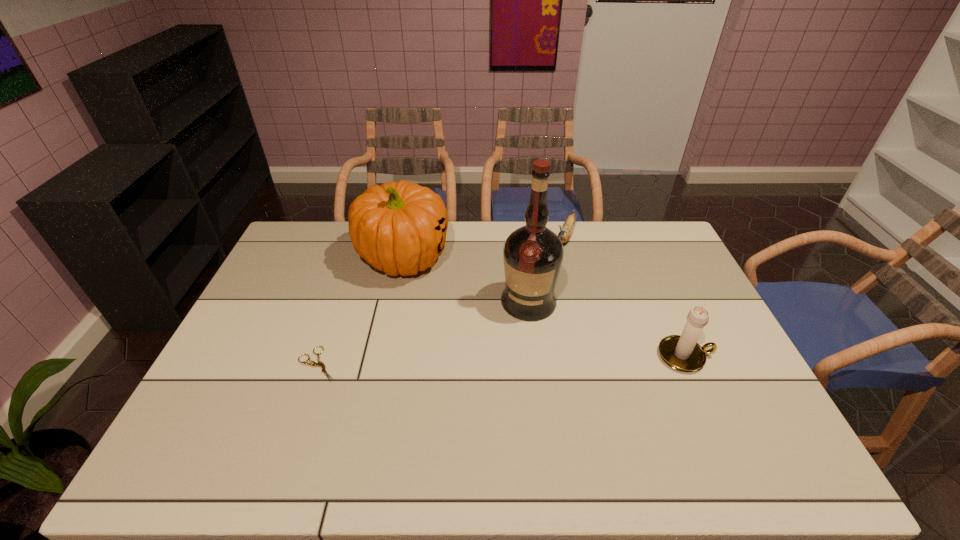
You are a GUI agent. You are given a task and a screenshot of the screen. Output one action in this format:
    pyautogui.click(x=<x>, y=<y>)
    Task: Click on the vacant region that satisfies the following two spatial constraints: 1. on the back side of the liquor; 2. on the left side of the second object from right to left
    Image resolution: width=960 pixels, height=540 pixels.
    Given the screenshot: What is the action you would take?
    pyautogui.click(x=520, y=236)

Identify the location of vacant area in the image that satisfies the following two spatial constraints: 1. on the front side of the candle holder; 2. on the handle side of the tallest object. The image size is (960, 540). (535, 356).

The width and height of the screenshot is (960, 540). Identify the location of vacant position in the image that satisfies the following two spatial constraints: 1. on the front side of the rightmost object; 2. on the handle side of the liquor. (535, 356).